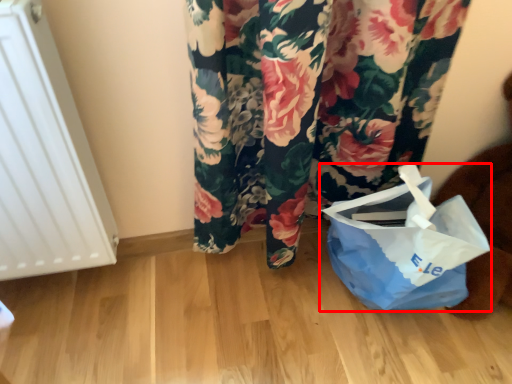
Question: Considering the relative positions of plastic bag (annotated by the red box) and radiator in the image provided, where is plastic bag (annotated by the red box) located with respect to the staircase?

Choices:
 (A) right
 (B) left

Answer: (A)